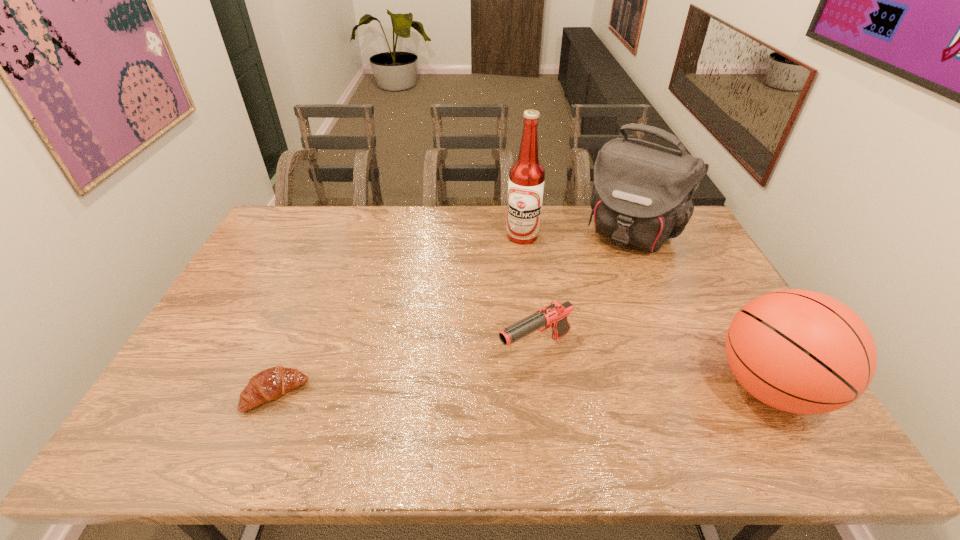
This screenshot has width=960, height=540. In order to click on crescent roll in this screenshot , I will do `click(269, 384)`.

The width and height of the screenshot is (960, 540). I want to click on the shortest object, so click(x=269, y=384).

You are a GUI agent. You are given a task and a screenshot of the screen. Output one action in this format:
    pyautogui.click(x=<x>, y=<y>)
    Task: Click on the third shortest object
    
    Given the screenshot: What is the action you would take?
    pyautogui.click(x=799, y=351)

I want to click on gun, so click(x=555, y=315).

At what (x,y) coordinates should I click in order to perform the action: click on alcohol. Please return your answer as a coordinate pair (x, y). Looking at the image, I should click on (526, 182).

Identify the location of shoulder bag. The image size is (960, 540). (642, 194).

Locate an element on the screen. Image resolution: width=960 pixels, height=540 pixels. vacant space located 0.060m on the right of the shortest object is located at coordinates (331, 394).

Identify the location of free location located on the left of the third tallest object. coord(629,387).

In order to click on free space located at the aiming end of the fourth tallest object in this screenshot , I will do click(x=416, y=411).

Locate an element on the screen. The height and width of the screenshot is (540, 960). vacant space located 0.210m at the aiming end of the fourth tallest object is located at coordinates (434, 401).